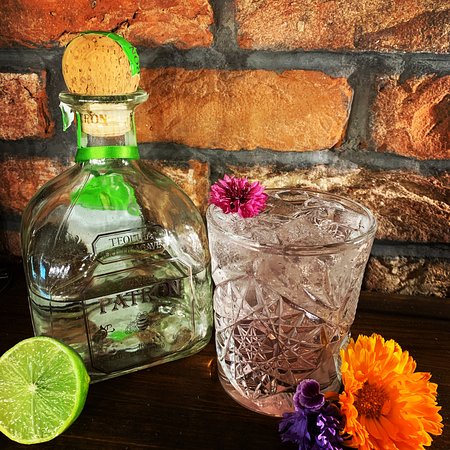
Image resolution: width=450 pixels, height=450 pixels. I want to click on table, so click(x=210, y=408).